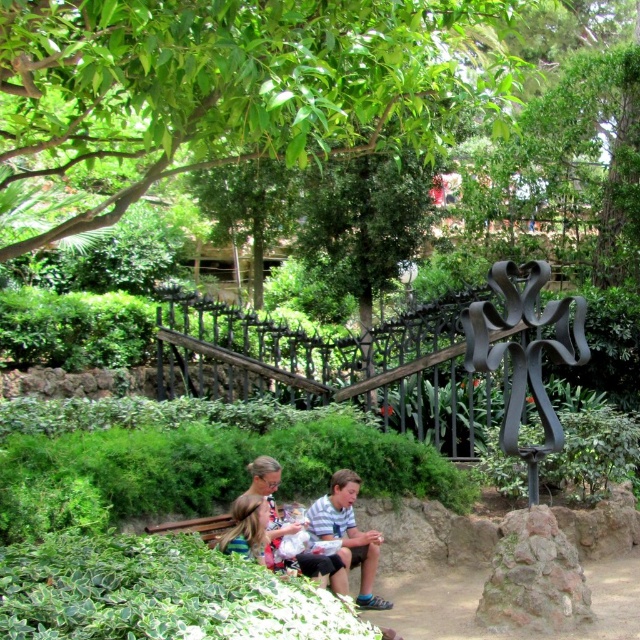
Question: Which of the following is the closest to the observer?

Choices:
 (A) green leafy tree at upper center
 (B) striped cotton shirt at center

Answer: (A)

Question: Can you confirm if green leafy tree at upper center is smaller than striped cotton shirt at center?

Choices:
 (A) no
 (B) yes

Answer: (A)

Question: Is green leafy tree at upper center wider than striped cotton shirt at center?

Choices:
 (A) yes
 (B) no

Answer: (A)

Question: Which point is farther to the camera?

Choices:
 (A) green leafy tree at upper center
 (B) striped cotton shirt at center

Answer: (B)

Question: Is green leafy tree at upper center positioned in front of striped cotton shirt at center?

Choices:
 (A) no
 (B) yes

Answer: (B)